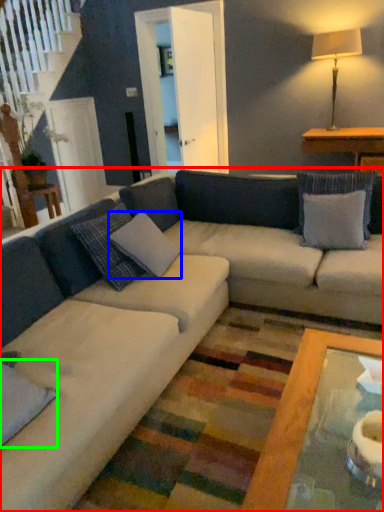
Question: Which object is positioned closest to studio couch (highlighted by a red box)? Select from pillow (highlighted by a blue box) and pillow (highlighted by a green box).

Choices:
 (A) pillow
 (B) pillow

Answer: (A)